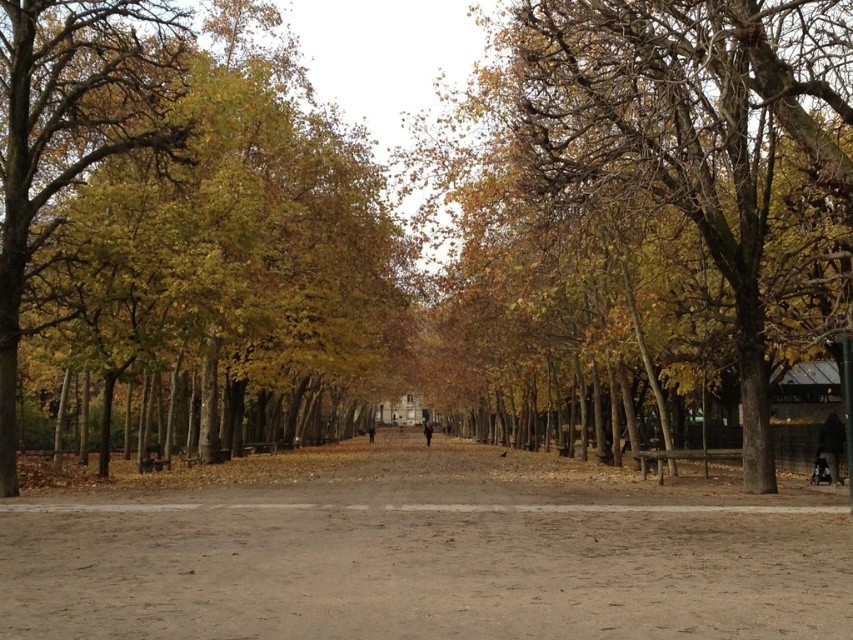
Question: Which object is farther from the camera taking this photo?

Choices:
 (A) brown dirt path at center
 (B) yellow/golden leaves at left
 (C) brown textured tree at center

Answer: (B)

Question: Is brown dirt path at center thinner than yellow/golden leaves at left?

Choices:
 (A) yes
 (B) no

Answer: (B)

Question: Is brown dirt path at center below yellow/golden leaves at left?

Choices:
 (A) yes
 (B) no

Answer: (A)

Question: Can you confirm if brown textured tree at center is bigger than yellow/golden leaves at left?

Choices:
 (A) no
 (B) yes

Answer: (A)

Question: Which object is farther from the camera taking this photo?

Choices:
 (A) yellow/golden leaves at left
 (B) brown dirt path at center

Answer: (A)

Question: Which object appears farthest from the camera in this image?

Choices:
 (A) brown textured tree at center
 (B) yellow/golden leaves at left

Answer: (B)